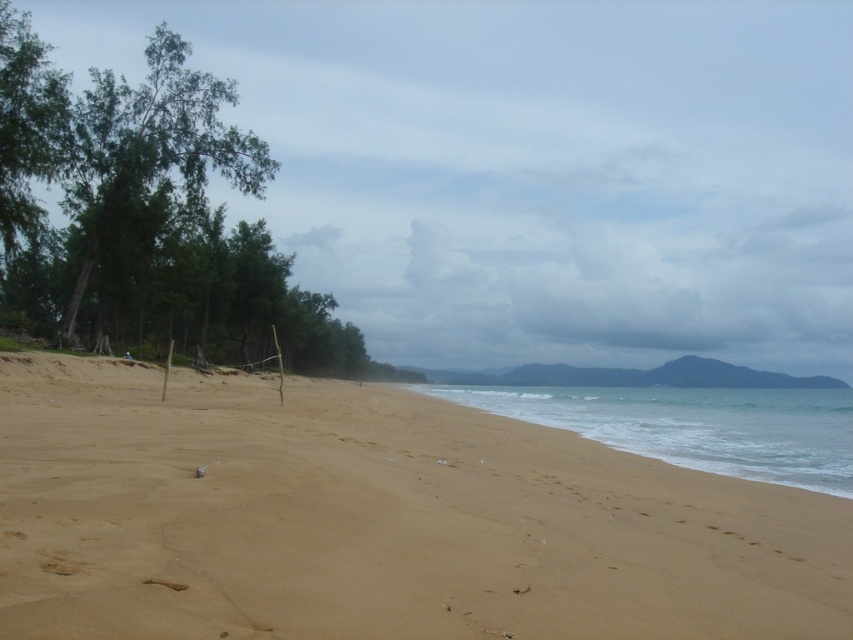
You are standing on the sandy beach at lower left and want to walk towards the green leafy tree at left. Which direction should you face to move towards it?

Since the sandy beach at lower left is to the right of the green leafy tree at left, you should face left to move towards the green leafy tree at left.

You are standing on the beach looking towards the trees. There are two points marked on the sand. One is at coordinate point (38, 461) and the other is at point (576, 408). Which point is closer to you?

Point (38, 461) is closer to the viewer than point (576, 408).

You are standing on the beach and see the sandy beach at lower left and the clear water at lower center. Which one is positioned to the left of the other?

The sandy beach at lower left is positioned to the left of the clear water at lower center.